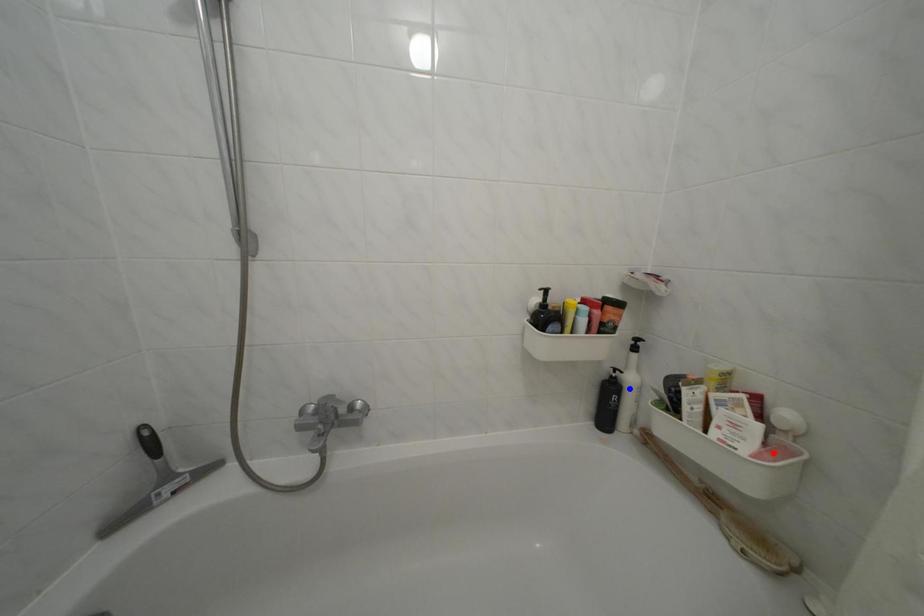
Question: In the image, two points are highlighted. Which point is nearer to the camera? Reply with the corresponding letter.

Choices:
 (A) blue point
 (B) red point

Answer: (B)